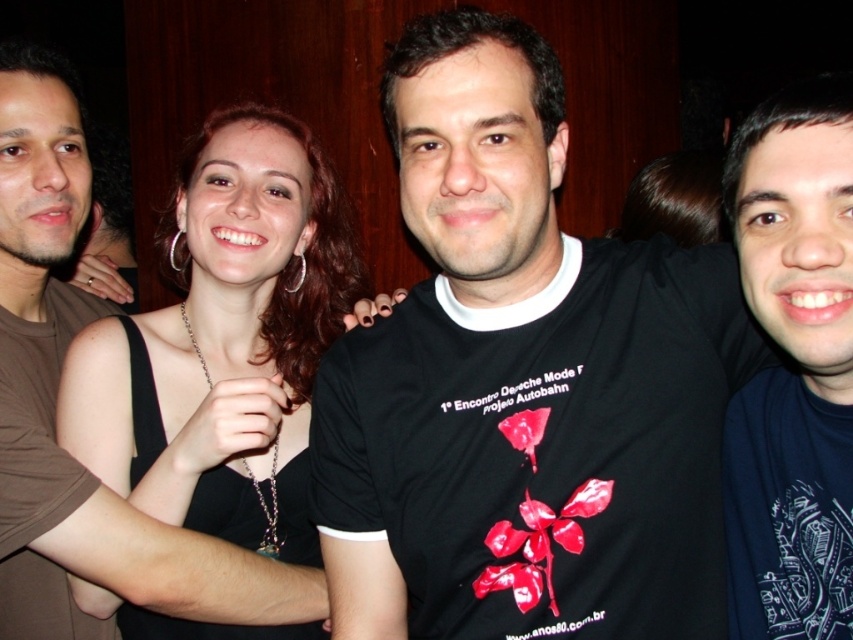
You are standing in front of the group of four people in the image. There is a point at coordinates point (206, 397) that you need to reach. Can you walk directly to it without moving past the central figure?

The point point (206, 397) is 1.20 meters from the viewer. Since the central figure is part of the group and the point is at that distance, you can walk directly to it without moving past the central figure as it is within reach.